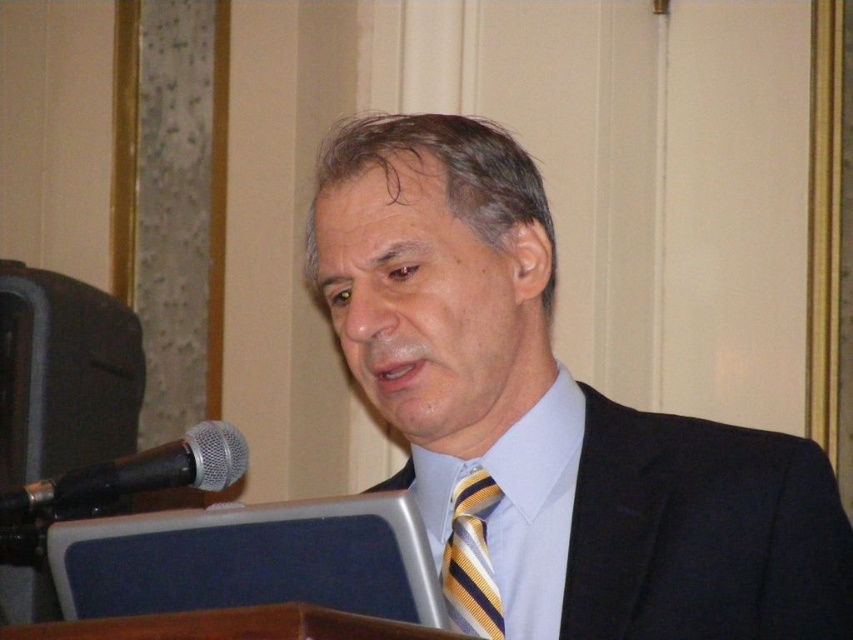
Question: Is black textured suit at center bigger than yellow striped tie at center?

Choices:
 (A) no
 (B) yes

Answer: (B)

Question: Is dark blue suit at center to the right of light blue satin dress shirt at center from the viewer's perspective?

Choices:
 (A) no
 (B) yes

Answer: (B)

Question: Which point appears closest to the camera in this image?

Choices:
 (A) (471, 586)
 (B) (10, 513)
 (C) (537, 467)

Answer: (B)

Question: Which object is closer to the camera taking this photo?

Choices:
 (A) yellow striped tie at center
 (B) dark blue suit at center

Answer: (B)

Question: Observing the image, what is the correct spatial positioning of black textured suit at center in reference to yellow striped tie at center?

Choices:
 (A) left
 (B) right

Answer: (B)

Question: Among these points, which one is farthest from the camera?

Choices:
 (A) (442, 547)
 (B) (349, 314)
 (C) (114, 460)
 (D) (490, 484)

Answer: (A)